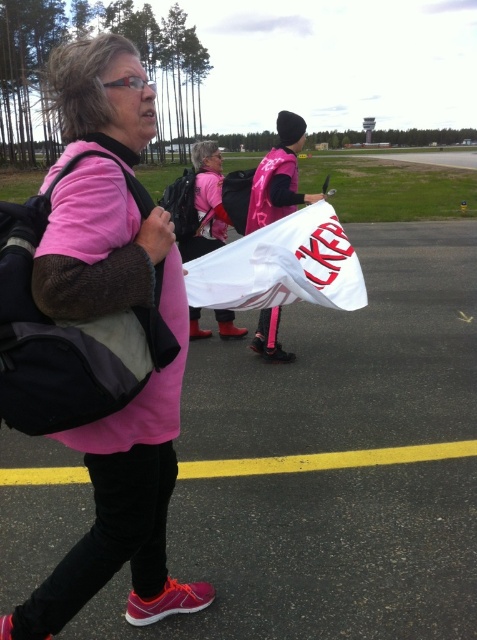
Question: Is pink fabric shirt at center in front of black fabric backpack at left?

Choices:
 (A) yes
 (B) no

Answer: (A)

Question: Which point is closer to the camera?

Choices:
 (A) pink fabric bag at center
 (B) black fabric backpack at left

Answer: (B)

Question: Which object is positioned closest to the black fabric backpack at left?

Choices:
 (A) white fabric at center
 (B) pink fabric bag at center
 (C) pink fabric shirt at center

Answer: (C)

Question: Is white fabric at center smaller than pink fabric shirt at center?

Choices:
 (A) yes
 (B) no

Answer: (A)

Question: Is pink fabric shirt at center positioned behind black fabric backpack at left?

Choices:
 (A) no
 (B) yes

Answer: (A)

Question: Which point is farther to the camera?

Choices:
 (A) (130, 396)
 (B) (162, 323)
 (C) (207, 180)
 (D) (0, 554)

Answer: (C)